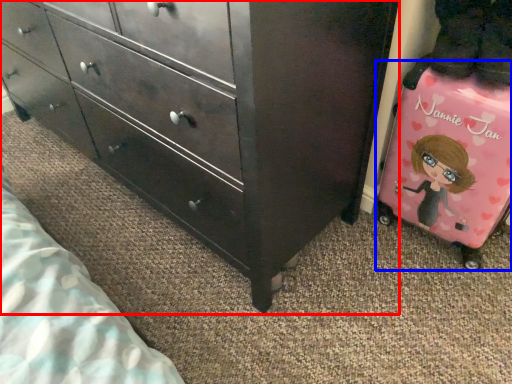
Question: Which object is further to the camera taking this photo, chest of drawers (highlighted by a red box) or luggage (highlighted by a blue box)?

Choices:
 (A) chest of drawers
 (B) luggage

Answer: (B)